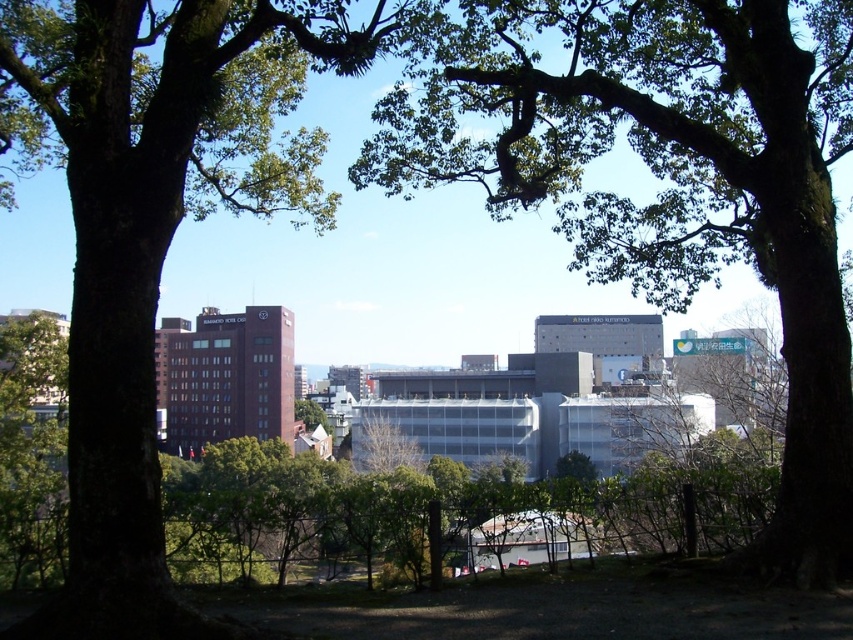
Does green leafy tree at center have a smaller size compared to green leafy tree at left?

No.

Is green leafy tree at center above green leafy tree at left?

No.

Is point (602, 241) more distant than point (90, 385)?

Yes, it is.

At what (x,y) coordinates should I click in order to perform the action: click on green leafy tree at center. Please return your answer as a coordinate pair (x, y). Looking at the image, I should click on (668, 179).